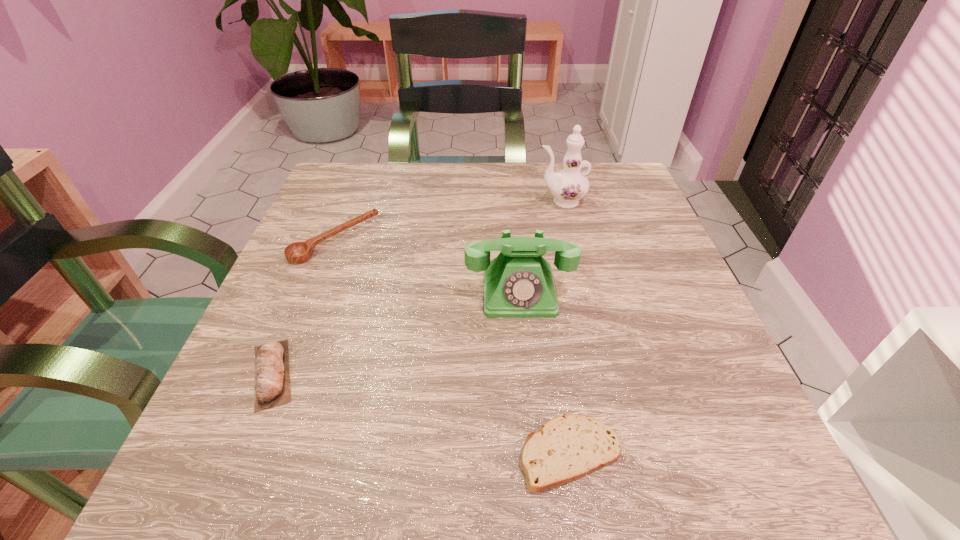
This screenshot has width=960, height=540. Find the location of `chinaware`. chinaware is located at coordinates (568, 186).

Image resolution: width=960 pixels, height=540 pixels. What are the coordinates of `the farthest object` in the screenshot? It's located at (568, 186).

The image size is (960, 540). In order to click on the fourth shortest object in this screenshot , I will do `click(518, 283)`.

This screenshot has width=960, height=540. In order to click on the third nearest object in this screenshot , I will do `click(518, 283)`.

Identify the location of the farther pita bread. The image size is (960, 540). click(x=272, y=379).

Identify the location of the left pita bread. (272, 379).

You are a GUI agent. You are given a task and a screenshot of the screen. Output one action in this format:
    pyautogui.click(x=<x>, y=<y>)
    Task: Click on the wooden spoon
    The width and height of the screenshot is (960, 540).
    Given the screenshot: What is the action you would take?
    pyautogui.click(x=298, y=252)

Locate an element on the screen. This screenshot has width=960, height=540. the shortest object is located at coordinates tap(567, 448).

Find the location of a particular element. The height and width of the screenshot is (540, 960). the nearest object is located at coordinates (567, 448).

The height and width of the screenshot is (540, 960). I want to click on free space located 0.270m at the spout of the chinaware, so click(419, 201).